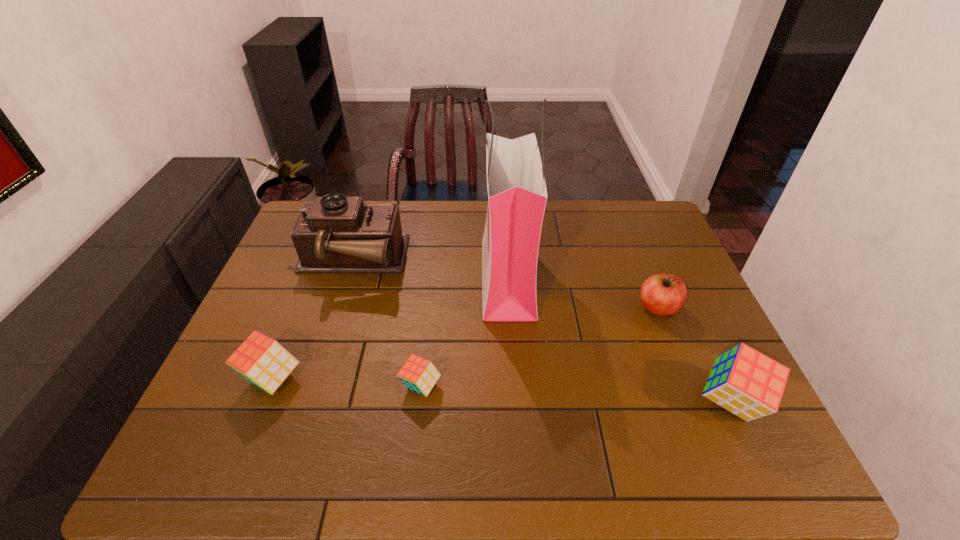
Find the location of a particular element. cube present at the right edge is located at coordinates tap(749, 384).

Where is `apple located at the right edge`? The height and width of the screenshot is (540, 960). apple located at the right edge is located at coordinates (662, 294).

What are the coordinates of `object present at the far left corner` in the screenshot? It's located at (335, 234).

The width and height of the screenshot is (960, 540). Find the location of `object that is at the near left corner`. object that is at the near left corner is located at coordinates (263, 361).

The width and height of the screenshot is (960, 540). Identify the location of object that is at the near right corner. (749, 384).

The width and height of the screenshot is (960, 540). I want to click on vacant space at the far edge, so click(586, 205).

The image size is (960, 540). I want to click on free space at the near edge, so click(x=448, y=395).

In the image, there is a desktop. Identify the location of vacant area at the left edge. (274, 273).

At what (x,y) coordinates should I click in order to perform the action: click on vacant space at the right edge of the desktop. Please return your answer as a coordinate pair (x, y). The height and width of the screenshot is (540, 960). Looking at the image, I should click on (653, 247).

Where is `vacant space at the near right corner of the desktop`? The image size is (960, 540). vacant space at the near right corner of the desktop is located at coordinates (724, 426).